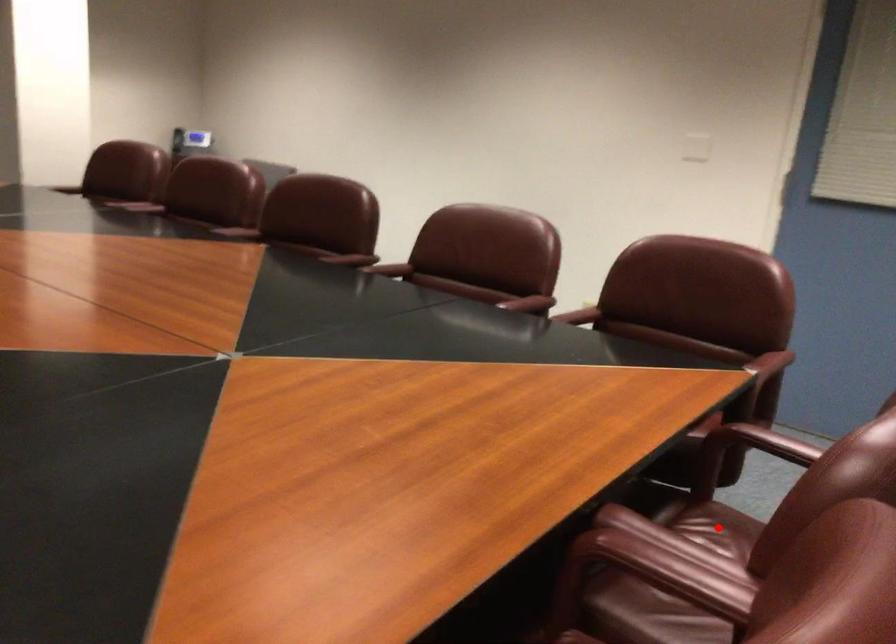
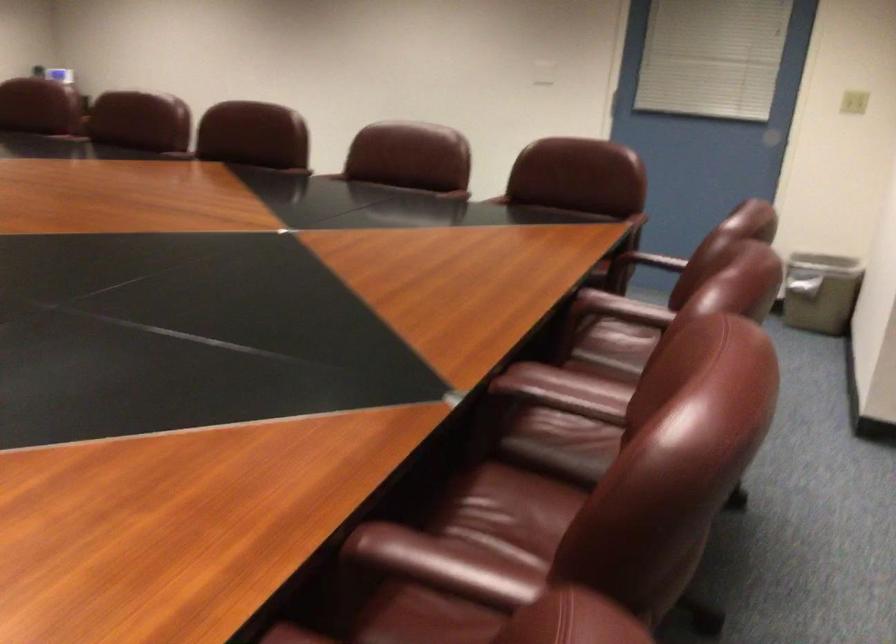
Question: I am providing you with two images of the same scene from different viewpoints. A red point is marked on the first image. At the location where the point appears in image 1, is it still visible in image 2?

Choices:
 (A) Yes
 (B) No

Answer: (B)